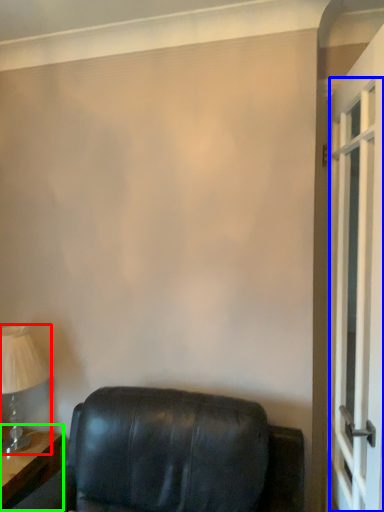
Question: Based on their relative distances, which object is farther from table lamp (highlighted by a red box)? Choose from screen door (highlighted by a blue box) and table (highlighted by a green box).

Choices:
 (A) screen door
 (B) table

Answer: (A)